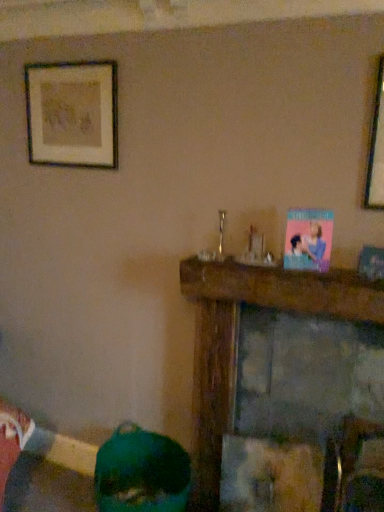
Question: Is wooden mantel at center to the left or to the right of wooden framed artwork at upper left in the image?

Choices:
 (A) left
 (B) right

Answer: (B)

Question: From the image's perspective, is wooden mantel at center positioned above or below wooden framed artwork at upper left?

Choices:
 (A) below
 (B) above

Answer: (A)

Question: Which object is positioned closest to the wooden framed artwork at upper left?

Choices:
 (A) green matte vase at lower left
 (B) wooden mantel at center

Answer: (B)

Question: Which object is the farthest from the green matte vase at lower left?

Choices:
 (A) wooden mantel at center
 (B) wooden framed artwork at upper left

Answer: (B)